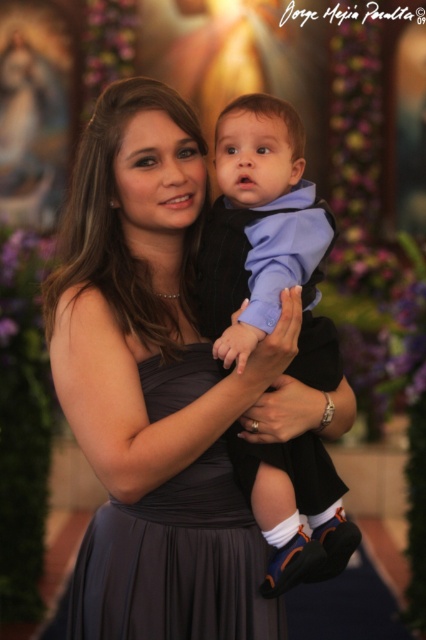
Based on the photo, you are standing in a room and see a point at coordinates (180,253). If you want to place a 2.5 meter long banner from your current position to that point, will it fit without bending?

The distance between you and the point is 1.94 meters. Since the banner is 2.5 meters long, it is longer than the required distance. Therefore, placing it straight would leave extra length, but it can still be placed without bending as long as there is enough space around.

You are a photographer adjusting your camera settings to capture a clear shot of the matte black vest at center. The vest is crucial for the photo. Given that the vest is 4.87 feet away, and your camera has a minimum focus distance of 5 feet, will you need to adjust your position to ensure the vest is in focus?

The matte black vest at center is 4.87 feet away from the camera, which is less than the camera minimum focus distance of 5 feet. Therefore, you need to move the camera back or the vest forward to ensure it is within the focus range.

You are a photographer adjusting the camera focus. The matte gray dress at center and the matte black vest at center are both in the frame. Which one is closer to the camera lens?

The matte gray dress at center is 6.38 inches from the matte black vest at center, so the distance between them is known, but without additional information about their positions relative to the camera, it is impossible to determine which is closer to the camera lens.